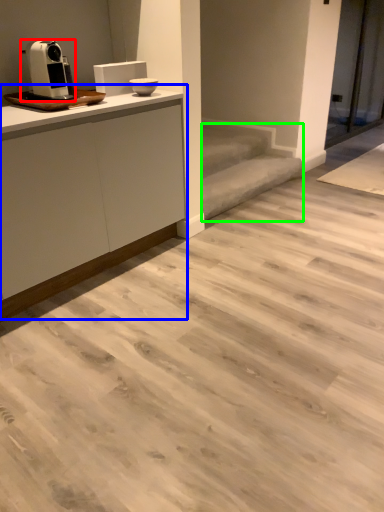
Question: Considering the real-world distances, which object is farthest from home appliance (highlighted by a red box)? cabinetry (highlighted by a blue box) or stair (highlighted by a green box)?

Choices:
 (A) cabinetry
 (B) stair

Answer: (B)